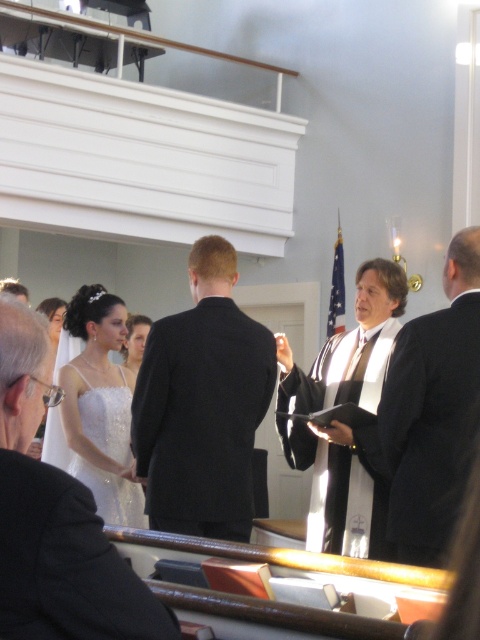
Is shiny black suit at center in front of black suit at center?

Yes, it is.

Between shiny black suit at center and black suit at center, which one has less height?

With less height is shiny black suit at center.

Which is behind, point (29, 608) or point (302, 372)?

Positioned behind is point (302, 372).

Image resolution: width=480 pixels, height=640 pixels. In order to click on shiny black suit at center in this screenshot , I will do pos(55,518).

Is black silk robe at right bigger than black suit at center?

Incorrect, black silk robe at right is not larger than black suit at center.

Is black silk robe at right positioned before black suit at center?

Yes, it is.

Find the location of a particular element. black silk robe at right is located at coordinates (432, 410).

Does black satin suit at center appear on the left side of matte white dress at center?

In fact, black satin suit at center is to the right of matte white dress at center.

Is black satin suit at center bigger than matte white dress at center?

Yes, black satin suit at center is bigger than matte white dress at center.

Who is more forward, (189, 278) or (134, 333)?

Positioned in front is point (134, 333).

This screenshot has height=640, width=480. Find the location of `black satin suit at center`. black satin suit at center is located at coordinates (202, 404).